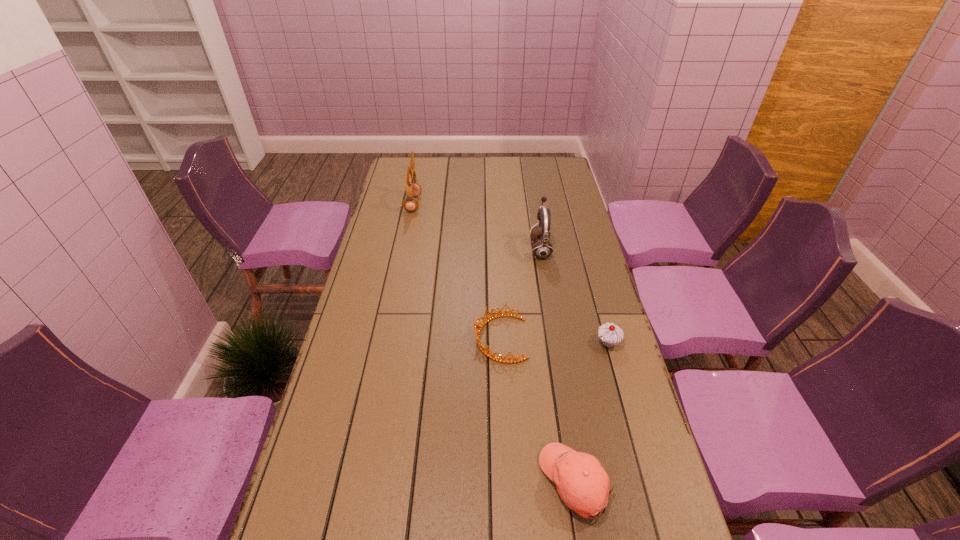
Identify the location of the leftmost object. (413, 189).

Find the location of `the farthest object`. the farthest object is located at coordinates (413, 189).

The height and width of the screenshot is (540, 960). Find the location of `the nearer earphone`. the nearer earphone is located at coordinates (542, 249).

Identify the location of the right earphone. (542, 249).

Locate an element on the screen. Image resolution: width=960 pixels, height=540 pixels. cupcake is located at coordinates (610, 334).

Where is `the third tallest object`? the third tallest object is located at coordinates (610, 334).

Locate an element on the screen. the nearest object is located at coordinates (582, 483).

Where is `the shortest object`? The width and height of the screenshot is (960, 540). the shortest object is located at coordinates (478, 328).

At what (x,y) coordinates should I click in order to perform the action: click on vacant region located on the front-facing side of the farther earphone. Please return your answer as a coordinate pair (x, y). Looking at the image, I should click on (488, 204).

Locate an element on the screen. The image size is (960, 540). vacant point located on the ear pads of the right earphone is located at coordinates (472, 249).